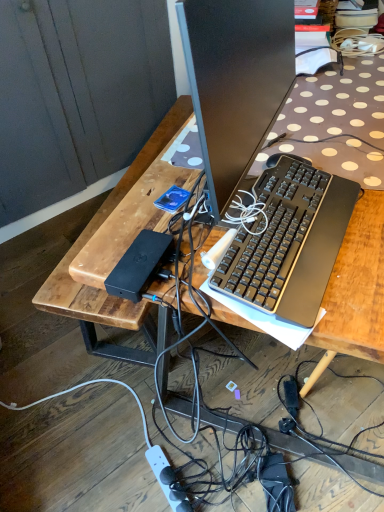
Question: Can you confirm if black plastic keyboard at center is shorter than white plastic power outlet at lower center?

Choices:
 (A) yes
 (B) no

Answer: (B)

Question: Is black plastic keyboard at center outside white plastic power outlet at lower center?

Choices:
 (A) no
 (B) yes

Answer: (B)

Question: Considering the relative sizes of black plastic keyboard at center and white plastic power outlet at lower center in the image provided, is black plastic keyboard at center thinner than white plastic power outlet at lower center?

Choices:
 (A) yes
 (B) no

Answer: (A)

Question: Can white plastic power outlet at lower center be found inside black plastic keyboard at center?

Choices:
 (A) yes
 (B) no

Answer: (B)

Question: Does black plastic keyboard at center turn towards white plastic power outlet at lower center?

Choices:
 (A) no
 (B) yes

Answer: (A)

Question: Would you say white plastic power outlet at lower center is inside or outside black plastic keyboard at center?

Choices:
 (A) inside
 (B) outside

Answer: (B)

Question: From a real-world perspective, relative to black plastic keyboard at center, is white plastic power outlet at lower center vertically above or below?

Choices:
 (A) above
 (B) below

Answer: (B)

Question: Does point (155, 466) appear closer or farther from the camera than point (319, 177)?

Choices:
 (A) closer
 (B) farther

Answer: (B)

Question: From the image's perspective, is white plastic power outlet at lower center above or below black plastic keyboard at center?

Choices:
 (A) below
 (B) above

Answer: (A)

Question: In terms of height, does white plastic power outlet at lower center look taller or shorter compared to wooden desk at center?

Choices:
 (A) short
 (B) tall

Answer: (A)

Question: In the image, is white plastic power outlet at lower center positioned in front of or behind wooden desk at center?

Choices:
 (A) front
 (B) behind

Answer: (B)

Question: Is point (152, 445) positioned closer to the camera than point (127, 177)?

Choices:
 (A) farther
 (B) closer

Answer: (A)

Question: Is white plastic power outlet at lower center spatially inside wooden desk at center, or outside of it?

Choices:
 (A) outside
 (B) inside

Answer: (A)

Question: In the image, is black plastic keyboard at center on the left side or the right side of white plastic power outlet at lower center?

Choices:
 (A) left
 (B) right

Answer: (B)

Question: Is black plastic keyboard at center taller or shorter than white plastic power outlet at lower center?

Choices:
 (A) tall
 (B) short

Answer: (A)